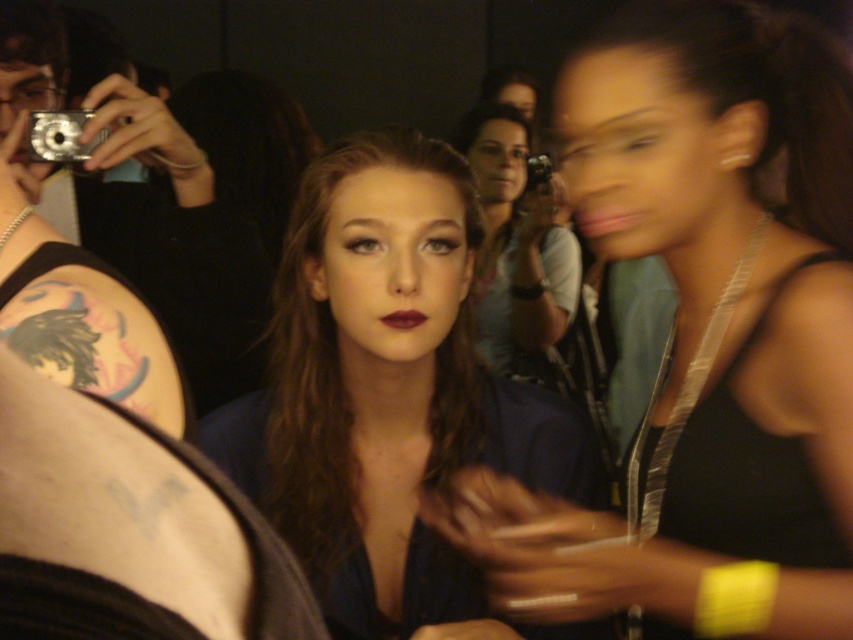
You are a photographer at a fashion event. You have two cameras, a matte black camera at center and a silver metallic camera at center. You need to place them side by side on a shelf that is 8 inches wide. Can both cameras fit on the shelf without overlapping?

The distance between the matte black camera at center and the silver metallic camera at center is 7.15 inches. Since the shelf is 8 inches wide, there is enough space to place both cameras side by side without overlapping.

You are a photographer at a fashion event. You notice the matte blue dress at center and the silver metallic camera at center. Which object is positioned to the right side from your perspective?

The silver metallic camera at center is positioned to the right of the matte blue dress at center.